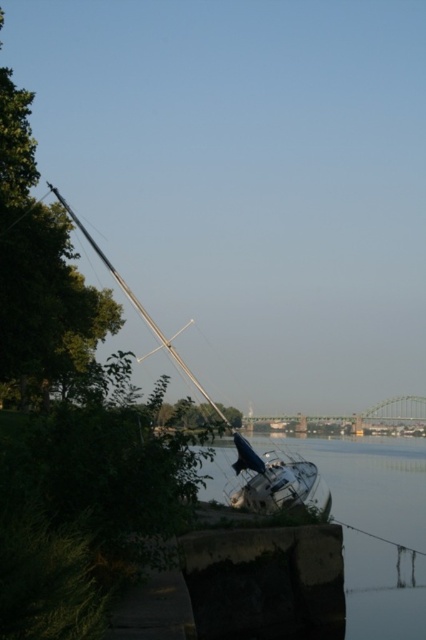
Can you confirm if smooth concrete wall at lower center is shorter than white glossy boat at center?

No.

Does smooth concrete wall at lower center appear under white glossy boat at center?

Indeed, smooth concrete wall at lower center is positioned under white glossy boat at center.

The width and height of the screenshot is (426, 640). What do you see at coordinates (379, 525) in the screenshot? I see `smooth concrete wall at lower center` at bounding box center [379, 525].

Find the location of a particular element. The image size is (426, 640). smooth concrete wall at lower center is located at coordinates (379, 525).

Measure the distance from smooth concrete wall at lower center to metallic silver mast at left.

smooth concrete wall at lower center is 32.22 feet from metallic silver mast at left.

Can you confirm if smooth concrete wall at lower center is bigger than metallic silver mast at left?

Yes, smooth concrete wall at lower center is bigger than metallic silver mast at left.

Is point (215, 492) positioned before point (129, 292)?

No, it is behind (129, 292).

Find the location of `smooth concrete wall at lower center`. smooth concrete wall at lower center is located at coordinates (379, 525).

How far apart are white glossy boat at center and metallic silver mast at left?

The distance of white glossy boat at center from metallic silver mast at left is 8.30 meters.

Is white glossy boat at center positioned at the back of metallic silver mast at left?

That is False.

I want to click on white glossy boat at center, so click(x=273, y=481).

The width and height of the screenshot is (426, 640). In order to click on white glossy boat at center in this screenshot , I will do `click(273, 481)`.